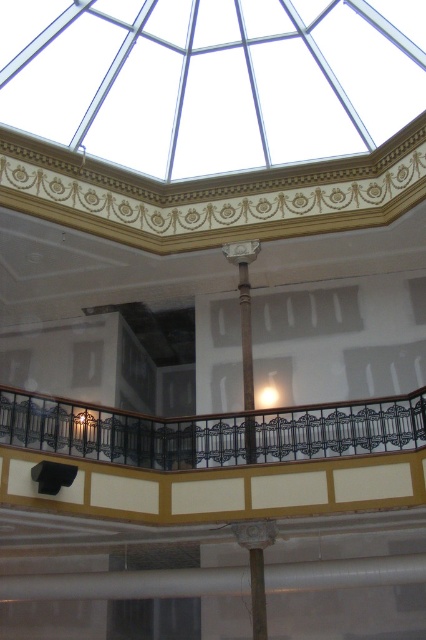
Looking at this image, you are standing at the entrance of the building and want to walk towards the glass dome ceiling. There are two points marked on the floor in front of you. The first point is at coordinate point(0, 436) and the second point is at coordinate point(244, 532). Which point will you reach first while walking towards the dome?

Point(0, 436) is in front of point(244, 532), so you will reach point(0, 436) first.

You are an architect designing a new building and want to ensure the black wrought iron balcony at center is proportionate to the matte gray column at center. Based on the image, which object should you make smaller to maintain balance?

The black wrought iron balcony at center is currently larger than the matte gray column at center. To maintain balance, you should make the black wrought iron balcony at center smaller.

You are standing on the black wrought iron balcony at center and want to reach the glass dome ceiling above. The distance between them is 40.05 meters. If your ladder is 30 meters long, will it be sufficient to reach the glass dome ceiling?

The distance between the black wrought iron balcony at center and the glass dome ceiling is 40.05 meters. Since the ladder is only 30 meters long, it will not be sufficient to reach the glass dome ceiling.